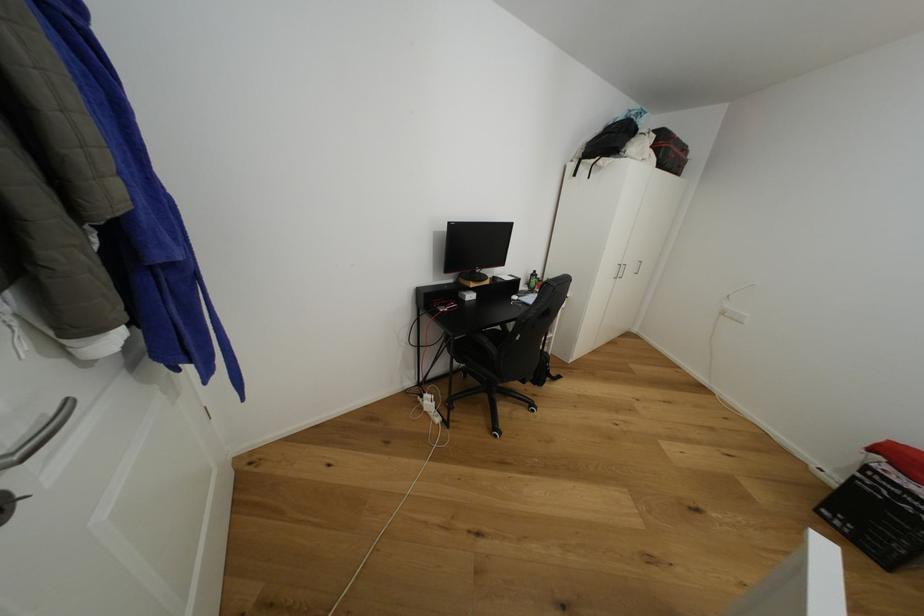
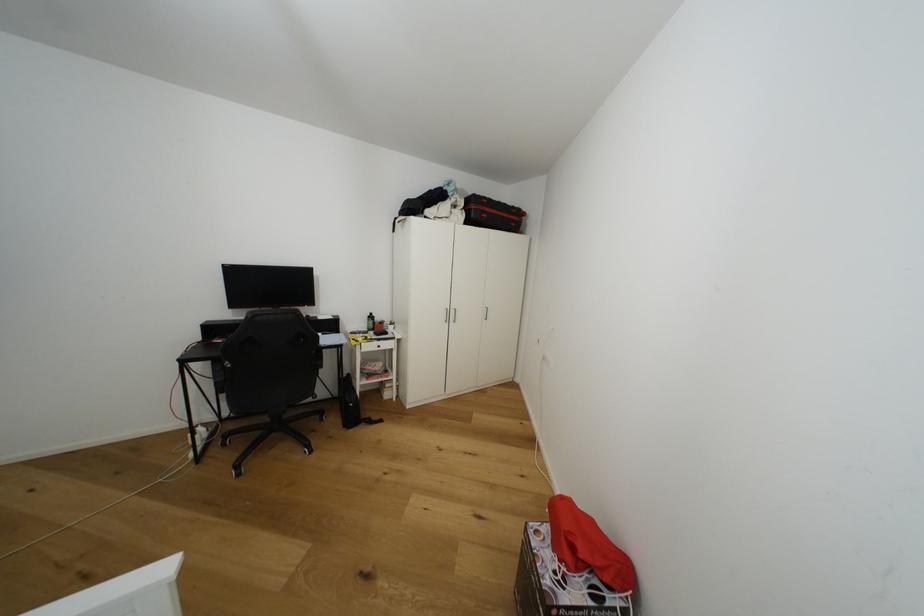
Question: In a continuous first-person perspective shot, in which direction is the camera moving?

Choices:
 (A) Left
 (B) Right
 (C) Forward
 (D) Backward

Answer: (B)